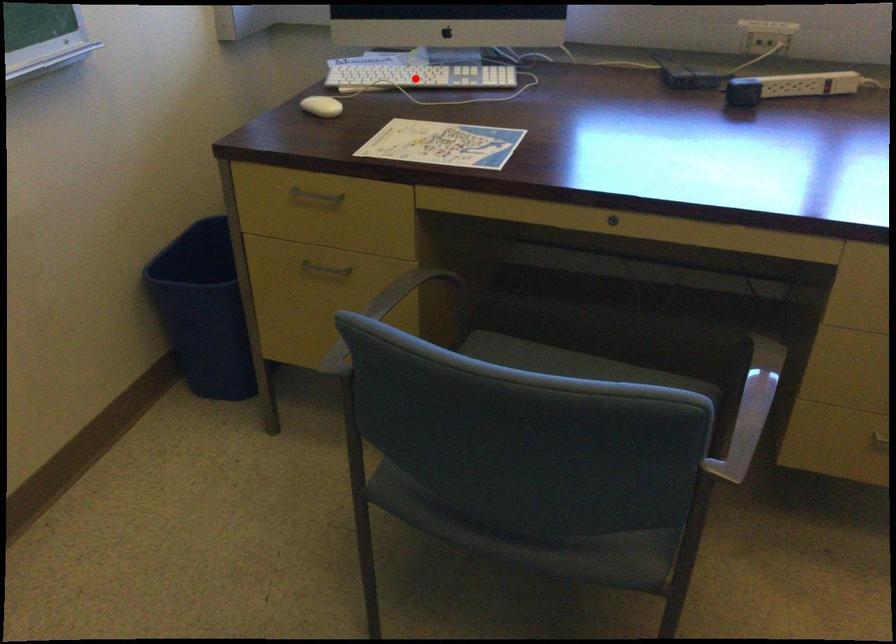
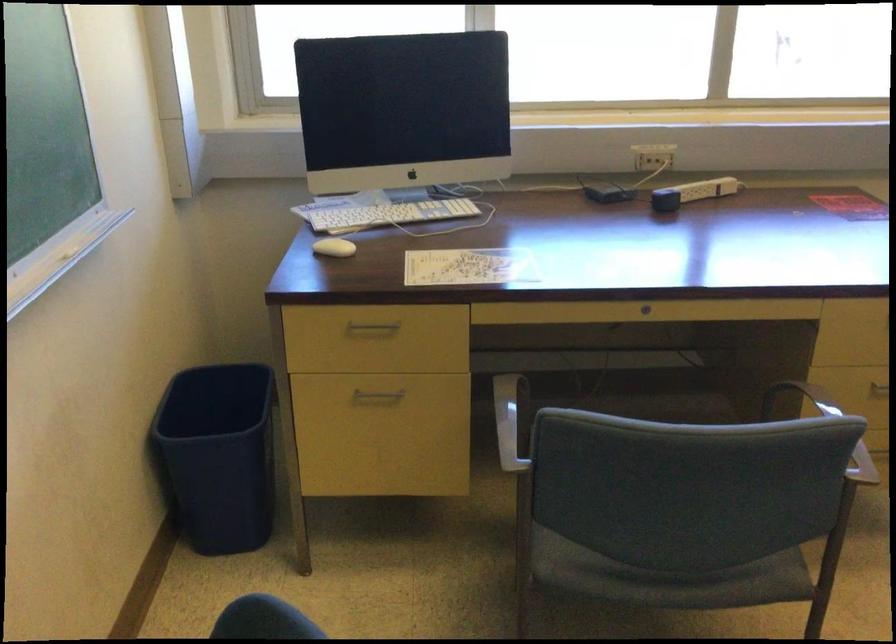
Question: I am providing you with two images of the same scene from different viewpoints. In image1, a red point is highlighted. Considering the same 3D point in image2, which of the following is correct?

Choices:
 (A) It is closer
 (B) It is farther

Answer: (B)